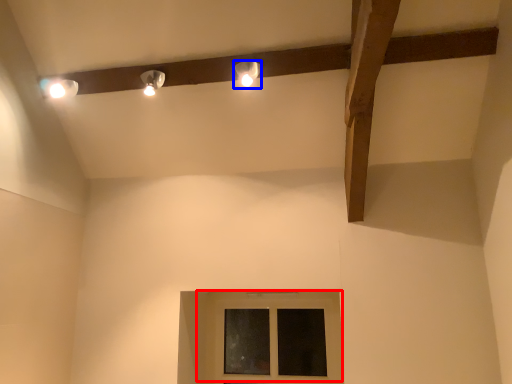
Question: Which point is further to the camera, window (highlighted by a red box) or lamp (highlighted by a blue box)?

Choices:
 (A) window
 (B) lamp

Answer: (A)